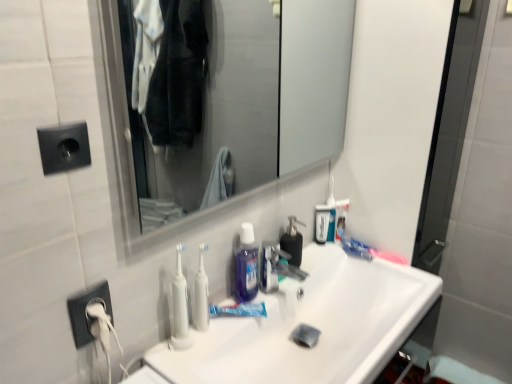
The image size is (512, 384). Find the location of `free space in front of pink plastic toothbrush at upper right, which ranks as the second toothbrush in left-to-right order`. free space in front of pink plastic toothbrush at upper right, which ranks as the second toothbrush in left-to-right order is located at coordinates pos(395,279).